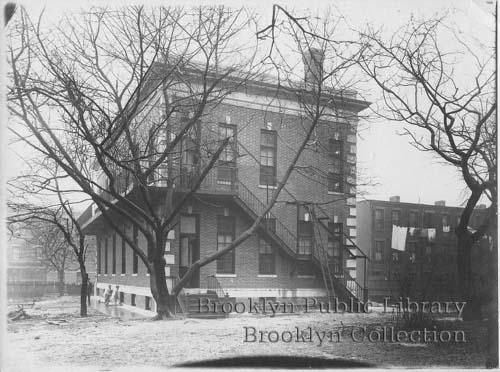
Locate an element on the screen. The width and height of the screenshot is (500, 372). bottom floor front right window is located at coordinates (334, 245).